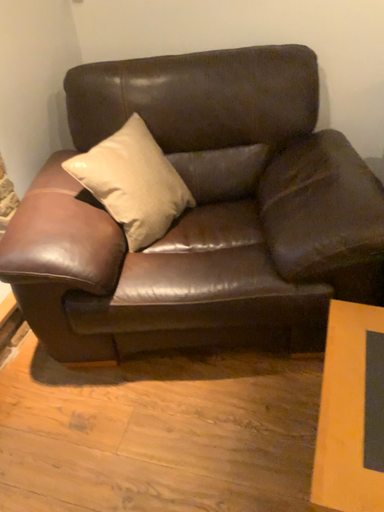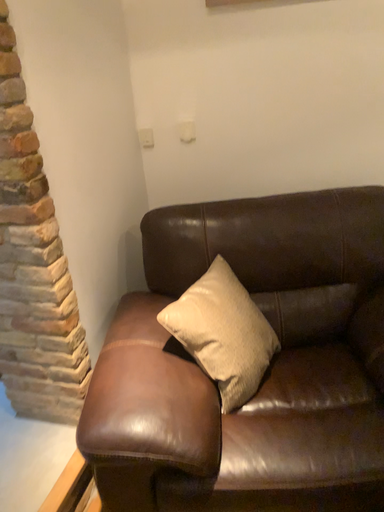
Question: Which way did the camera rotate in the video?

Choices:
 (A) rotated downward
 (B) rotated upward

Answer: (B)